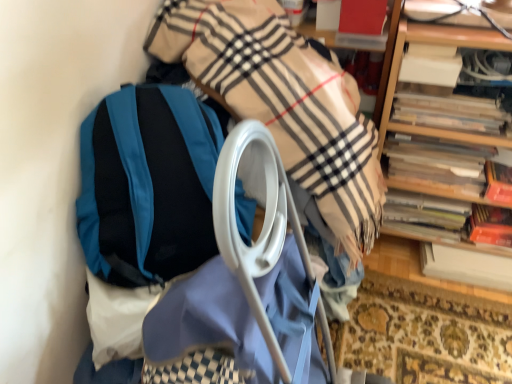
Question: Is teal fabric backpack at left bigger or smaller than wooden book at right, the third book in the bottom-to-top sequence?

Choices:
 (A) big
 (B) small

Answer: (A)

Question: Is teal fabric backpack at left taller or shorter than wooden book at right, marked as the 3th book in a top-to-bottom arrangement?

Choices:
 (A) tall
 (B) short

Answer: (A)

Question: Which of these objects is positioned closest to the wooden book at right, marked as the 3th book in a top-to-bottom arrangement?

Choices:
 (A) wooden bookshelf at upper right
 (B) white paper at right, which is counted as the 5th book, starting from the top
 (C) hardcover book at right, which is the 4th book from top to bottom
 (D) white paper at upper right, the fifth book positioned from the bottom
 (E) teal fabric backpack at left

Answer: (A)

Question: Estimate the real-world distances between objects in this image. Which object is closer to the wooden bookshelf at upper right?

Choices:
 (A) wooden book at right, the third book in the bottom-to-top sequence
 (B) wooden spines at right, which ranks as the fourth book in bottom-to-top order
 (C) white paper at right, which is counted as the 1th book, starting from the bottom
 (D) teal fabric backpack at left
 (E) hardcover book at right, which is the 4th book from top to bottom

Answer: (A)